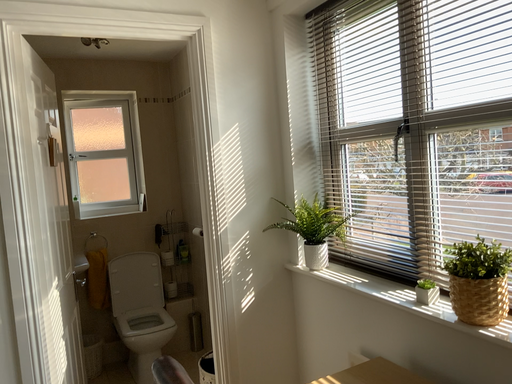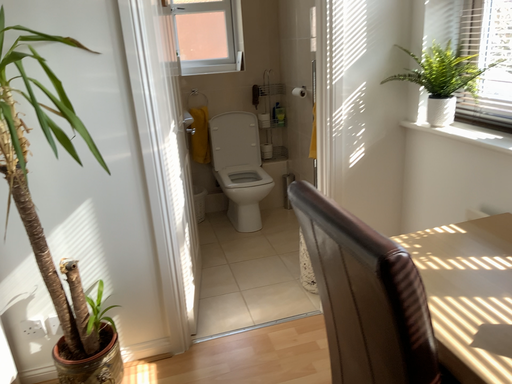
Question: Which way did the camera rotate in the video?

Choices:
 (A) rotated downward
 (B) rotated upward

Answer: (A)